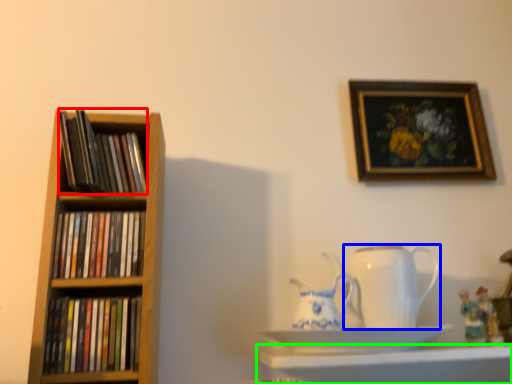
Question: Estimate the real-world distances between objects in this image. Which object is farther from book (highlighted by a red box), jug (highlighted by a blue box) or shelf (highlighted by a green box)?

Choices:
 (A) jug
 (B) shelf

Answer: (B)